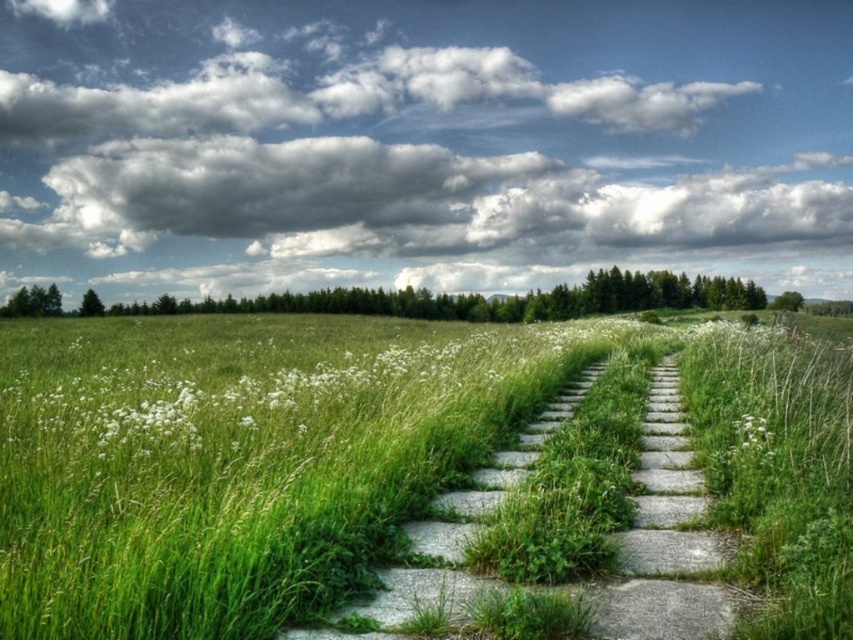
Locate an element on the screen. This screenshot has width=853, height=640. cloudy sky at upper center is located at coordinates (421, 144).

Can you confirm if cloudy sky at upper center is thinner than white fluffy flower at center-right?

No, cloudy sky at upper center is not thinner than white fluffy flower at center-right.

Is point (251, 205) farther from camera compared to point (737, 449)?

That is True.

Find the location of a particular element. The height and width of the screenshot is (640, 853). cloudy sky at upper center is located at coordinates (421, 144).

Between cloudy sky at upper center and green stone path at center, which one is positioned higher?

cloudy sky at upper center

Which is behind, point (78, 129) or point (439, 570)?

The point (78, 129) is behind.

Is point (438, 96) closer to camera compared to point (433, 524)?

No, it is not.

Identify the location of cloudy sky at upper center. The image size is (853, 640). (421, 144).

The width and height of the screenshot is (853, 640). I want to click on cloudy sky at upper center, so click(x=421, y=144).

In the scene shown: Does cloudy sky at upper center have a lesser width compared to green grassy pasture at center?

In fact, cloudy sky at upper center might be wider than green grassy pasture at center.

Between point (305, 230) and point (297, 428), which one is positioned behind?

The point (305, 230) is behind.

At what (x,y) coordinates should I click in order to perform the action: click on cloudy sky at upper center. Please return your answer as a coordinate pair (x, y). This screenshot has width=853, height=640. Looking at the image, I should click on (421, 144).